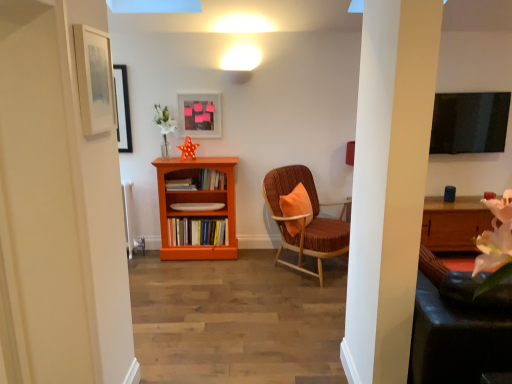
Question: Is matte plastic picture frame at upper center, the 1th picture frame when ordered from right to left, spatially inside hardcover books at center, which ranks as the 1th book in bottom-to-top order, or outside of it?

Choices:
 (A) outside
 (B) inside

Answer: (A)

Question: Considering the positions of matte plastic picture frame at upper center, which appears as the second picture frame when viewed from the left, and hardcover books at center, the 3th book from the top, in the image, is matte plastic picture frame at upper center, which appears as the second picture frame when viewed from the left, wider or thinner than hardcover books at center, the 3th book from the top,?

Choices:
 (A) wide
 (B) thin

Answer: (B)

Question: Which is nearer to the orange wood bookshelf at center?

Choices:
 (A) matte plastic picture frame at upper center, which appears as the second picture frame when viewed from the left
 (B) wooden bookshelf at center, the 2th book viewed from the top
 (C) wooden bookshelf at center, the 1th book from the top
 (D) hardcover books at center, the 3th book from the top
 (E) velvet brown chair with orange cushion at center

Answer: (D)

Question: Which object is the farthest from the velvet orange swivel chair at right?

Choices:
 (A) matte plastic picture frame at upper center, which appears as the 1th picture frame when viewed from the back
 (B) orange wood bookshelf at center
 (C) matte white picture frame at upper left, the 2th picture frame from the right
 (D) wooden bookshelf at center, which ranks as the second book in bottom-to-top order
 (E) hardcover books at center, the 3th book from the top

Answer: (A)